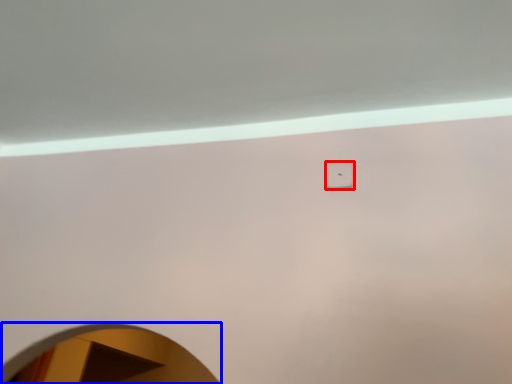
Question: Among these objects, which one is nearest to the camera, light switch (highlighted by a red box) or mirror (highlighted by a blue box)?

Choices:
 (A) light switch
 (B) mirror

Answer: (B)